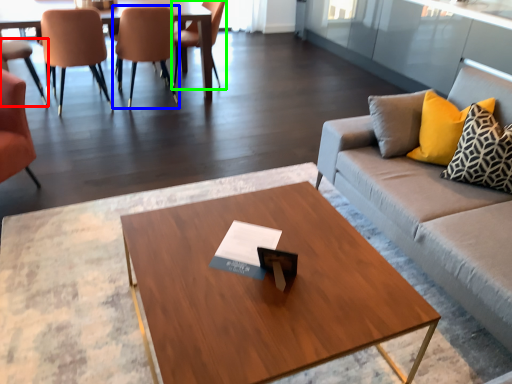
Question: Which object is the farthest from chair (highlighted by a red box)? Choose among these: chair (highlighted by a blue box) or chair (highlighted by a green box).

Choices:
 (A) chair
 (B) chair

Answer: (B)